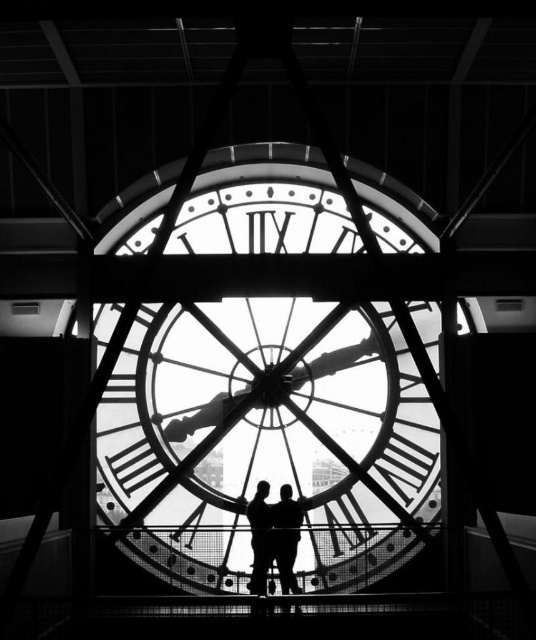
Question: Is metallic clock at center smaller than silhouette figure at center?

Choices:
 (A) yes
 (B) no

Answer: (B)

Question: Can you confirm if metallic clock at center is thinner than silhouette figure at center?

Choices:
 (A) no
 (B) yes

Answer: (A)

Question: Considering the real-world distances, which object is farthest from the metallic clock at center?

Choices:
 (A) black matte couple at center
 (B) silhouette figure at center

Answer: (B)

Question: Based on their relative distances, which object is nearer to the silhouette figure at center?

Choices:
 (A) black matte couple at center
 (B) metallic clock at center

Answer: (A)

Question: Is the position of metallic clock at center less distant than that of black matte couple at center?

Choices:
 (A) no
 (B) yes

Answer: (A)

Question: Which object appears farthest from the camera in this image?

Choices:
 (A) black matte couple at center
 (B) metallic clock at center
 (C) silhouette figure at center

Answer: (B)